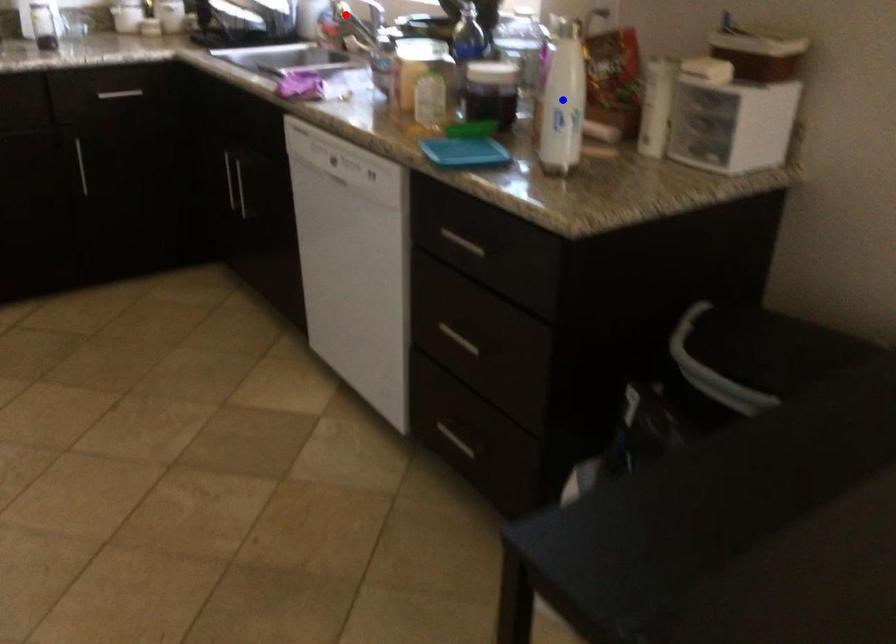
Question: In the image, two points are highlighted. Which point is nearer to the camera? Reply with the corresponding letter.

Choices:
 (A) blue point
 (B) red point

Answer: (A)